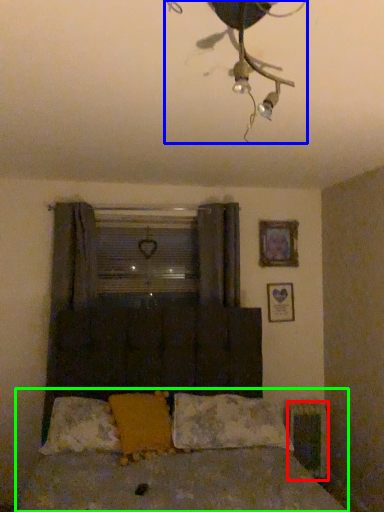
Question: Based on their relative distances, which object is farther from radiator (highlighted by a red box)? Choose from lamp (highlighted by a blue box) and bed (highlighted by a green box).

Choices:
 (A) lamp
 (B) bed

Answer: (A)